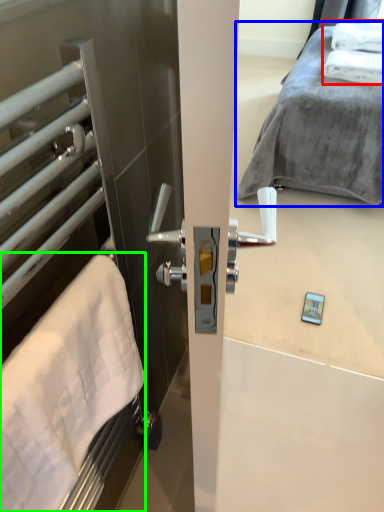
Question: Estimate the real-world distances between objects in this image. Which object is closer to bath towel (highlighted by a red box), bed (highlighted by a blue box) or bath towel (highlighted by a green box)?

Choices:
 (A) bed
 (B) bath towel

Answer: (A)